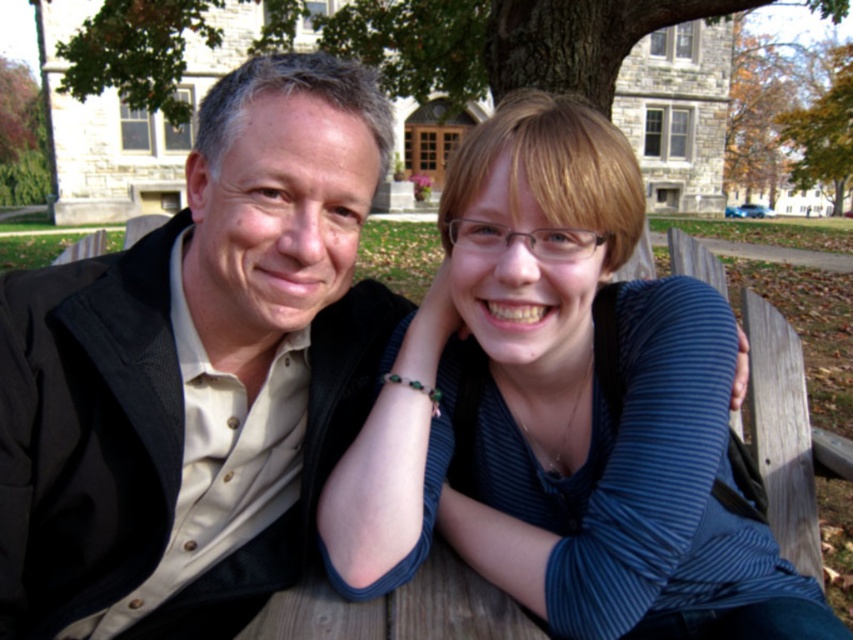
Can you confirm if matte black jacket at left is bigger than blue striped shirt at center?

Correct, matte black jacket at left is larger in size than blue striped shirt at center.

Is matte black jacket at left smaller than blue striped shirt at center?

Incorrect, matte black jacket at left is not smaller in size than blue striped shirt at center.

Identify the location of matte black jacket at left. (196, 372).